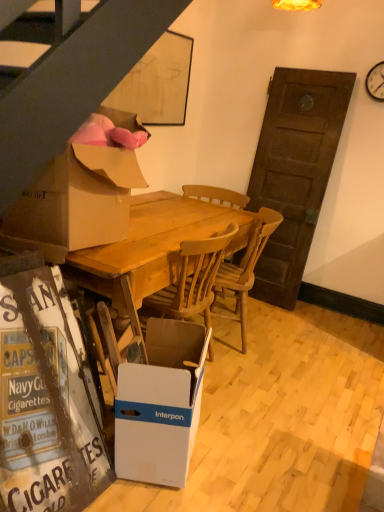
Question: Is wooden table at center situated inside white plastic clock at upper right or outside?

Choices:
 (A) inside
 (B) outside

Answer: (B)

Question: Considering the positions of wooden table at center and white plastic clock at upper right in the image, is wooden table at center taller or shorter than white plastic clock at upper right?

Choices:
 (A) tall
 (B) short

Answer: (A)

Question: Considering the real-world distances, which object is farthest from the wooden table at center?

Choices:
 (A) white cardboard at lower left
 (B) white plastic clock at upper right
 (C) white cardboard box at lower center, the 2th box positioned from the top
 (D) wooden chair at center
 (E) cardboard box at left, the 2th box from the bottom

Answer: (B)

Question: Which object is positioned farthest from the white cardboard at lower left?

Choices:
 (A) cardboard box at left, the 2th box from the bottom
 (B) wooden chair at center
 (C) white plastic clock at upper right
 (D) wooden table at center
 (E) white cardboard box at lower center, the 2th box positioned from the top

Answer: (C)